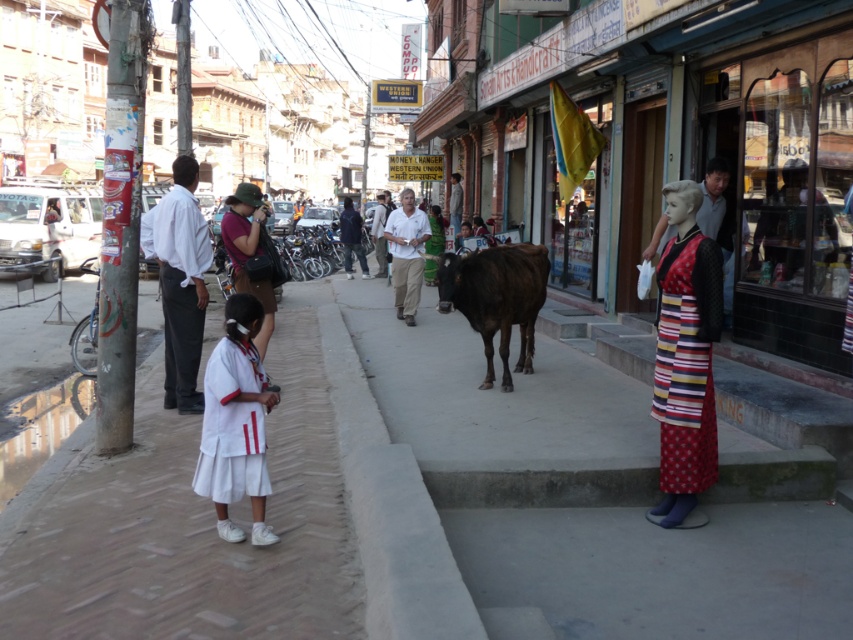
Question: Observing the image, what is the correct spatial positioning of gray concrete curb at center in reference to matte brown hat at center?

Choices:
 (A) right
 (B) left

Answer: (A)

Question: Can you confirm if striped fabric dress at right is positioned above brown matte cow at center?

Choices:
 (A) yes
 (B) no

Answer: (B)

Question: Which object appears closest to the camera in this image?

Choices:
 (A) gray concrete curb at center
 (B) brown matte cow at center
 (C) white fabric dress at lower left

Answer: (C)

Question: Which point is closer to the camera taking this photo?

Choices:
 (A) (395, 236)
 (B) (299, 502)

Answer: (B)

Question: Which point is farther to the camera?

Choices:
 (A) brown matte cow at center
 (B) white matte shirt at center
 (C) striped fabric dress at right

Answer: (B)

Question: Does white cotton shirt at left appear under white matte shirt at center?

Choices:
 (A) no
 (B) yes

Answer: (B)